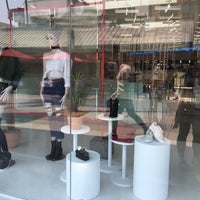
The image size is (200, 200). In order to click on vent in this screenshot , I will do `click(125, 7)`.